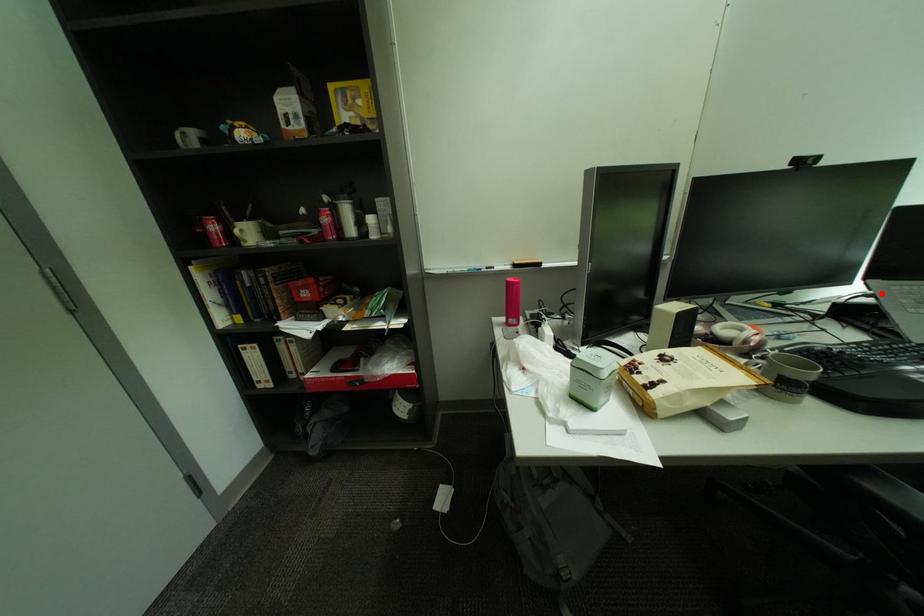
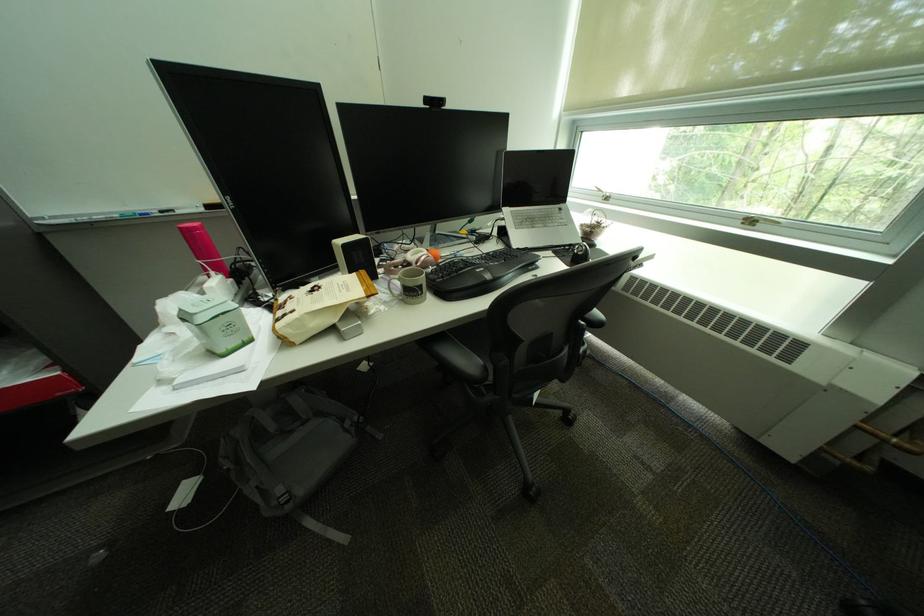
Question: I am providing you with two images of the same scene from different viewpoints. Given a red point in image1, look at the same physical point in image2. Is it:

Choices:
 (A) Closer to the viewpoint
 (B) Farther from the viewpoint

Answer: (A)